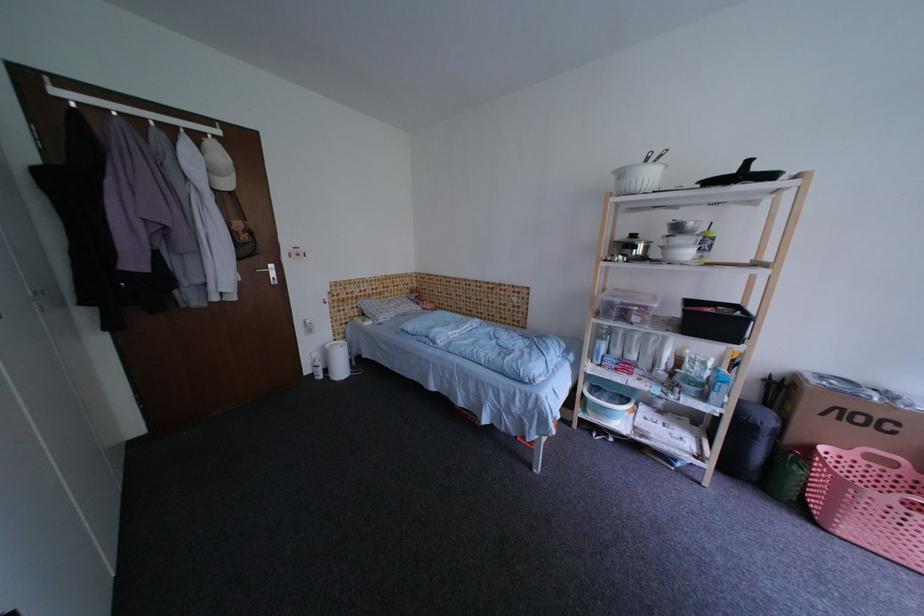
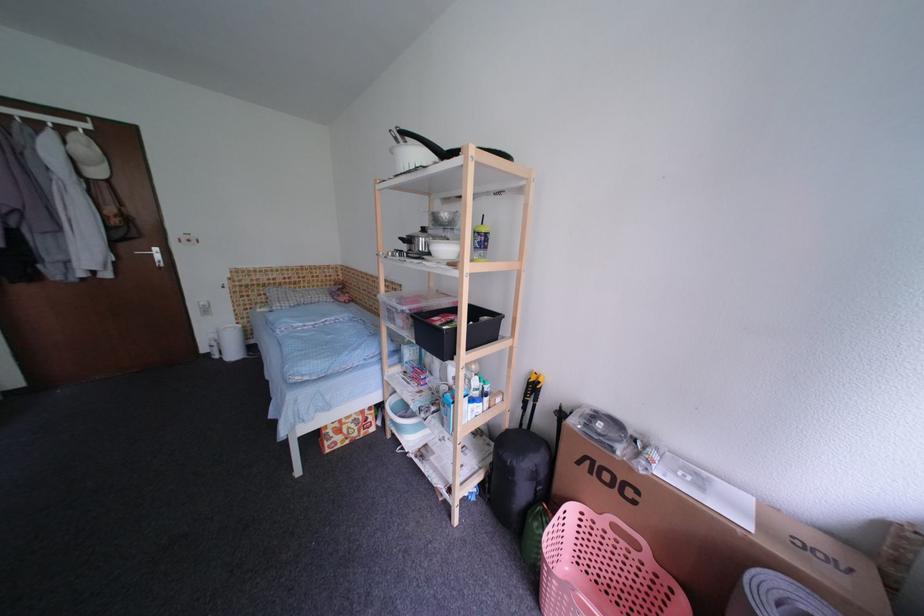
The point at (884,469) is marked in the first image. Where is the corresponding point in the second image?

(630, 546)